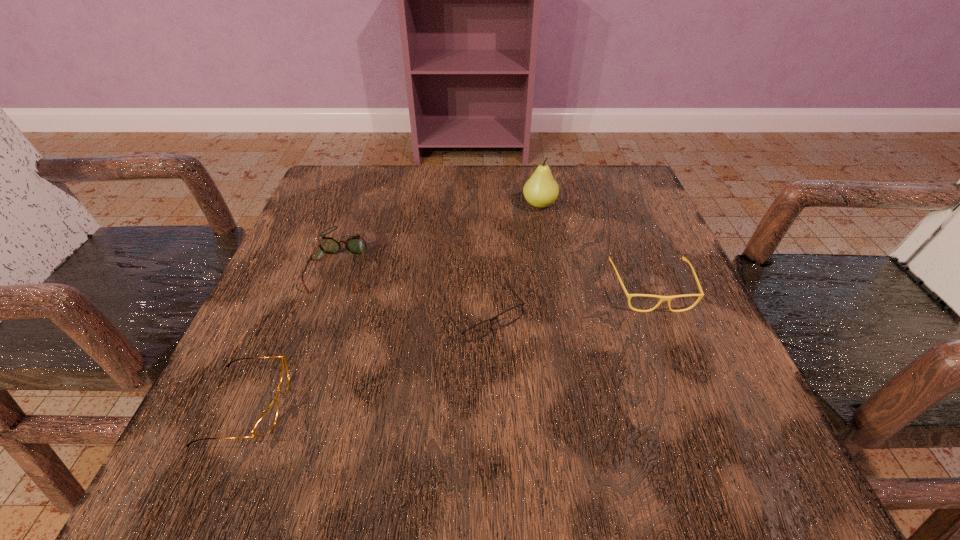
Locate an element on the screen. The image size is (960, 540). free location that satisfies the following two spatial constraints: 1. in front of the lenses of the rightmost object; 2. on the front-facing side of the nearest object is located at coordinates (698, 406).